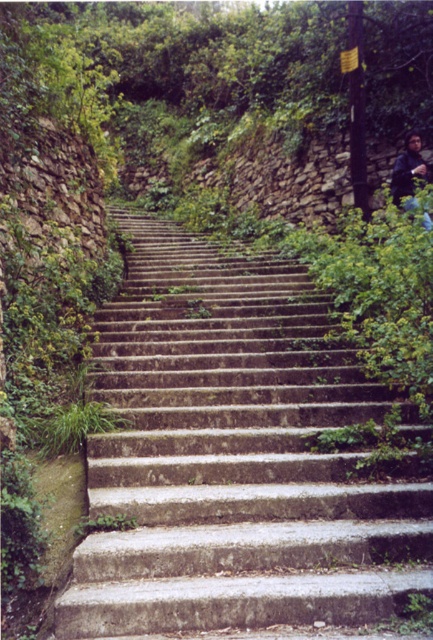
Question: Is gray concrete stairs at center thinner than dark blue fabric jacket at upper right?

Choices:
 (A) yes
 (B) no

Answer: (B)

Question: Can you confirm if gray concrete stairs at center is bigger than dark blue fabric jacket at upper right?

Choices:
 (A) yes
 (B) no

Answer: (A)

Question: Which of the following is the farthest from the observer?

Choices:
 (A) dark blue fabric jacket at upper right
 (B) gray concrete stairs at center

Answer: (A)

Question: Does gray concrete stairs at center appear on the right side of dark blue fabric jacket at upper right?

Choices:
 (A) yes
 (B) no

Answer: (B)

Question: Which object is farther from the camera taking this photo?

Choices:
 (A) dark blue fabric jacket at upper right
 (B) gray concrete stairs at center

Answer: (A)